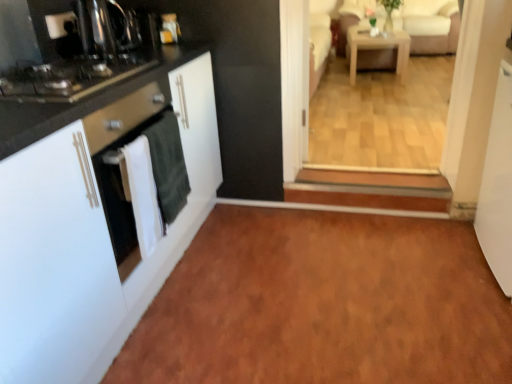
Question: Considering the relative positions of black glass stove at left and brown laminate floor at lower center in the image provided, is black glass stove at left in front of brown laminate floor at lower center?

Choices:
 (A) no
 (B) yes

Answer: (A)

Question: Can you confirm if black glass stove at left is wider than brown laminate floor at lower center?

Choices:
 (A) no
 (B) yes

Answer: (A)

Question: Is black glass stove at left located outside brown laminate floor at lower center?

Choices:
 (A) yes
 (B) no

Answer: (A)

Question: Is black glass stove at left not near brown laminate floor at lower center?

Choices:
 (A) yes
 (B) no

Answer: (A)

Question: From a real-world perspective, is black glass stove at left positioned under brown laminate floor at lower center based on gravity?

Choices:
 (A) no
 (B) yes

Answer: (A)

Question: Considering the relative sizes of black glass stove at left and brown laminate floor at lower center in the image provided, is black glass stove at left smaller than brown laminate floor at lower center?

Choices:
 (A) no
 (B) yes

Answer: (B)

Question: Is brown laminate floor at lower center facing towards black glass stove at left?

Choices:
 (A) yes
 (B) no

Answer: (B)

Question: Considering the relative sizes of brown laminate floor at lower center and black glass stove at left in the image provided, is brown laminate floor at lower center taller than black glass stove at left?

Choices:
 (A) no
 (B) yes

Answer: (A)

Question: From the image's perspective, is brown laminate floor at lower center on top of black glass stove at left?

Choices:
 (A) no
 (B) yes

Answer: (A)

Question: Would you say black glass stove at left is part of brown laminate floor at lower center's contents?

Choices:
 (A) yes
 (B) no

Answer: (B)

Question: Does brown laminate floor at lower center appear on the right side of black glass stove at left?

Choices:
 (A) no
 (B) yes

Answer: (B)

Question: Is brown laminate floor at lower center further to the viewer compared to black glass stove at left?

Choices:
 (A) no
 (B) yes

Answer: (A)

Question: Is light wood/wooden table at center positioned beyond the bounds of beige fabric couch at upper right?

Choices:
 (A) yes
 (B) no

Answer: (A)